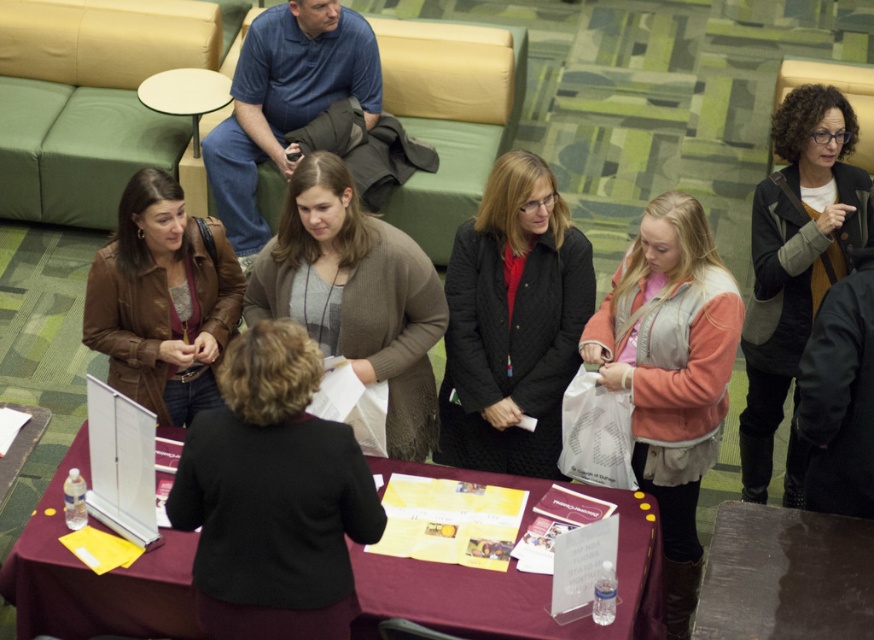
Is maroon fabric table at center above quilted black jacket at center?

No, maroon fabric table at center is not above quilted black jacket at center.

Is maroon fabric table at center positioned before quilted black jacket at center?

Yes, it is in front of quilted black jacket at center.

Find the location of a particular element. The height and width of the screenshot is (640, 874). maroon fabric table at center is located at coordinates (512, 588).

Find the location of a particular element. maroon fabric table at center is located at coordinates (512, 588).

This screenshot has width=874, height=640. In order to click on quilted black jacket at center in this screenshot , I will do `click(512, 323)`.

Which is more to the right, quilted black jacket at center or light pink fleece vest at center?

light pink fleece vest at center

Find the location of `quilted black jacket at center`. quilted black jacket at center is located at coordinates (512, 323).

Can you confirm if quilted black jacket at center is bigger than brown leather table at lower right?

Yes, quilted black jacket at center is bigger than brown leather table at lower right.

Does quilted black jacket at center have a lesser height compared to brown leather table at lower right?

Incorrect, quilted black jacket at center's height does not fall short of brown leather table at lower right's.

The height and width of the screenshot is (640, 874). I want to click on quilted black jacket at center, so click(x=512, y=323).

Find the location of a particular element. This screenshot has width=874, height=640. quilted black jacket at center is located at coordinates (512, 323).